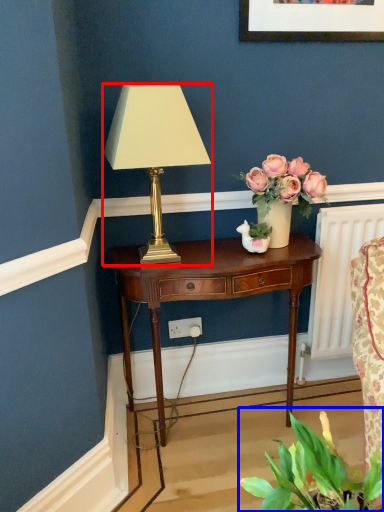
Question: Which of the following is the farthest to the observer, lamp (highlighted by a red box) or houseplant (highlighted by a blue box)?

Choices:
 (A) lamp
 (B) houseplant

Answer: (A)